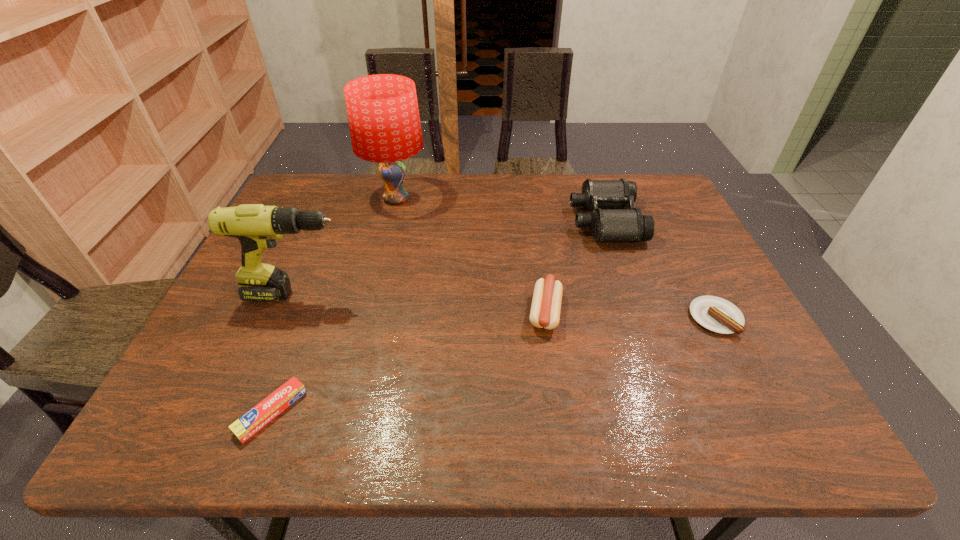
In order to click on unoccupied area between the drill and the fifth tallest object in this screenshot , I will do `click(507, 306)`.

The image size is (960, 540). I want to click on empty space between the toothpaste and the shorter sausage, so click(493, 365).

At what (x,y) coordinates should I click in order to perform the action: click on free space between the tallest object and the fourth shortest object. Please return your answer as a coordinate pair (x, y). Looking at the image, I should click on click(500, 210).

Where is `object that is the nearest to the shortest object`? This screenshot has width=960, height=540. object that is the nearest to the shortest object is located at coordinates (256, 226).

Locate an element on the screen. object that is the fourth closest to the left sausage is located at coordinates (256, 226).

Identify the location of vacant space that satisfies the following two spatial constraints: 1. on the back side of the toothpaste; 2. on the handle side of the second tallest object. (316, 294).

Locate an element on the screen. vacant region that satisfies the following two spatial constraints: 1. on the back side of the shorter sausage; 2. through the eyepieces of the fourth shortest object is located at coordinates (665, 221).

This screenshot has width=960, height=540. I want to click on free space that satisfies the following two spatial constraints: 1. on the handle side of the drill; 2. on the right side of the fourth object from left to right, so click(x=291, y=312).

Locate an element on the screen. The height and width of the screenshot is (540, 960). free region that satisfies the following two spatial constraints: 1. on the back side of the shortest object; 2. on the handle side of the drill is located at coordinates (316, 294).